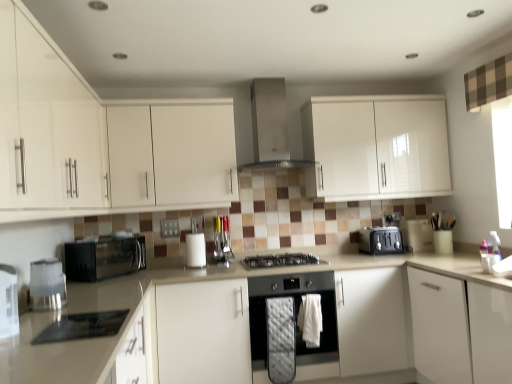
Question: Is stainless steel range hood at upper center, marked as the second home appliance in a right-to-left arrangement, in front of or behind white glossy countertop at center in the image?

Choices:
 (A) behind
 (B) front

Answer: (A)

Question: Which is correct: stainless steel range hood at upper center, placed as the 3th home appliance when sorted from bottom to top, is inside white glossy countertop at center, or outside of it?

Choices:
 (A) outside
 (B) inside

Answer: (A)

Question: Which object is the closest to the satin silver toaster at right, which is counted as the 5th appliance, starting from the front?

Choices:
 (A) white matte cabinet at right, the fifth cabinetry in the left-to-right sequence
 (B) black matte gas stove at center
 (C) black glass cooktop at lower left, which appears as the second appliance when viewed from the left
 (D) white glossy countertop at lower left
 (E) metallic silver utensil rack at center, which is the second appliance in back-to-front order

Answer: (A)

Question: Considering the real-world distances, which object is farthest from the black glass cooktop at lower left, placed as the fourth appliance when sorted from right to left?

Choices:
 (A) white glossy cabinet at left, the first cabinetry viewed from the left
 (B) white glossy cabinet at upper center, the 2th cabinetry when ordered from right to left
 (C) white glossy countertop at center
 (D) metallic silver kettle at left
 (E) white glossy countertop at lower left

Answer: (B)